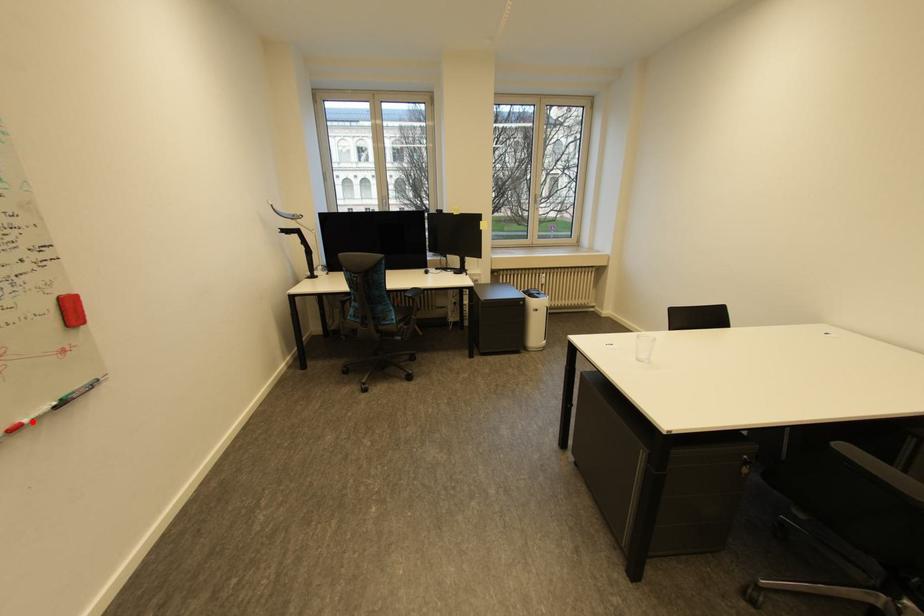
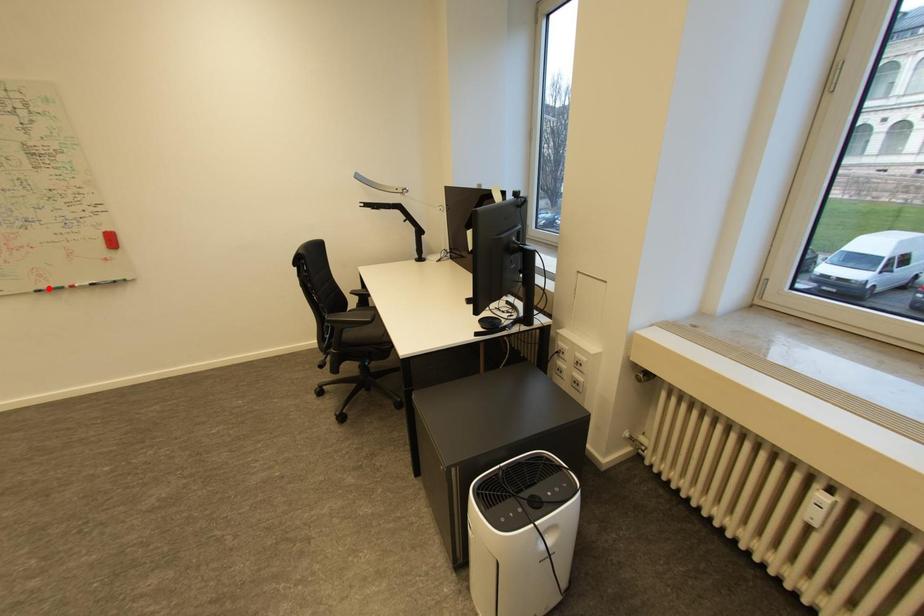
I am providing you with two images of the same scene from different viewpoints. A red point is marked on the first image and another point is marked on the second image. Are the points marked in image1 and image2 representing the same 3D position?

No